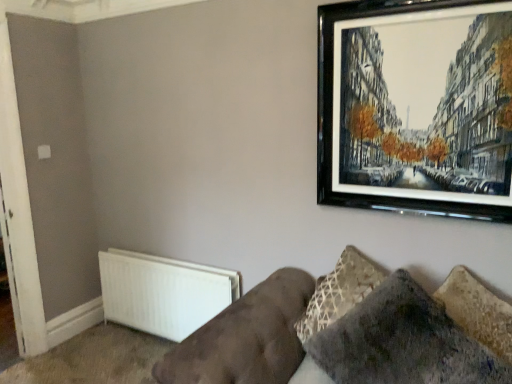
Question: Does point (291, 304) appear closer or farther from the camera than point (6, 150)?

Choices:
 (A) farther
 (B) closer

Answer: (B)

Question: In the image, is velvet brown couch at lower right positioned in front of or behind white matte door at left?

Choices:
 (A) front
 (B) behind

Answer: (A)

Question: Based on their relative distances, which object is farther from the white matte radiator at lower left?

Choices:
 (A) velvet brown couch at lower right
 (B) black glossy picture frame at upper right
 (C) velvet gray pillow at lower right
 (D) white matte door at left

Answer: (B)

Question: Estimate the real-world distances between objects in this image. Which object is farther from the white matte door at left?

Choices:
 (A) velvet gray pillow at lower right
 (B) velvet brown couch at lower right
 (C) white matte radiator at lower left
 (D) black glossy picture frame at upper right

Answer: (A)